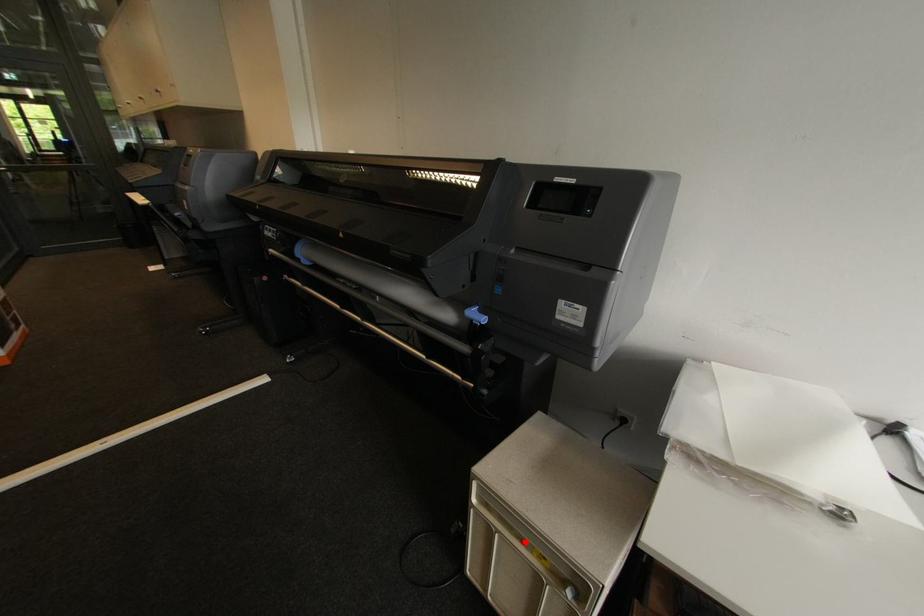
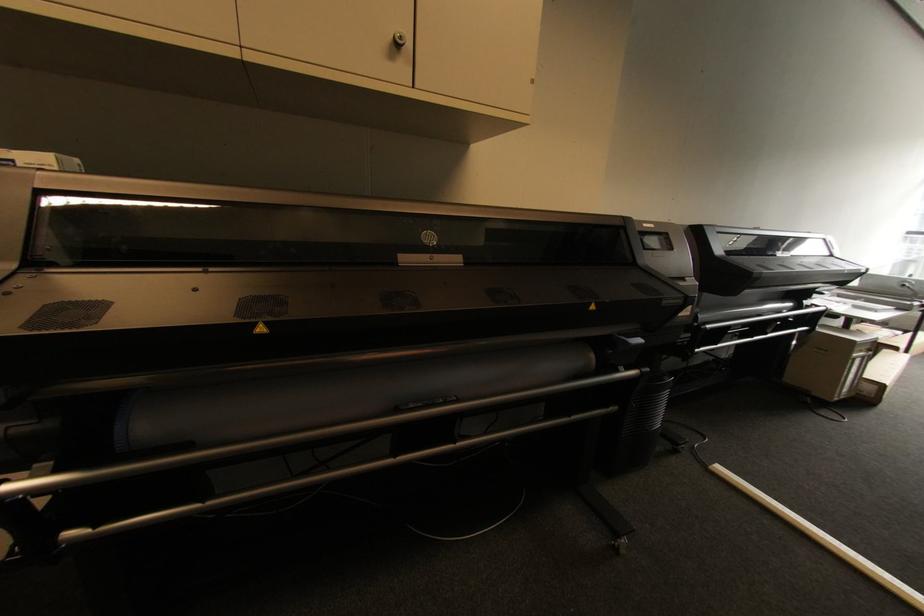
Find the pixel in the second image that matches the highlighted location in the first image.

(867, 352)